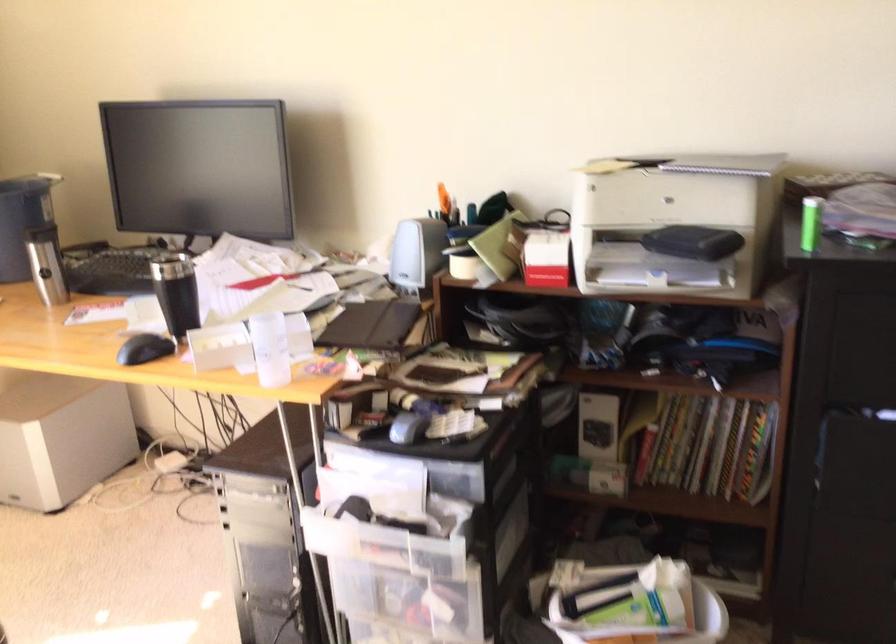
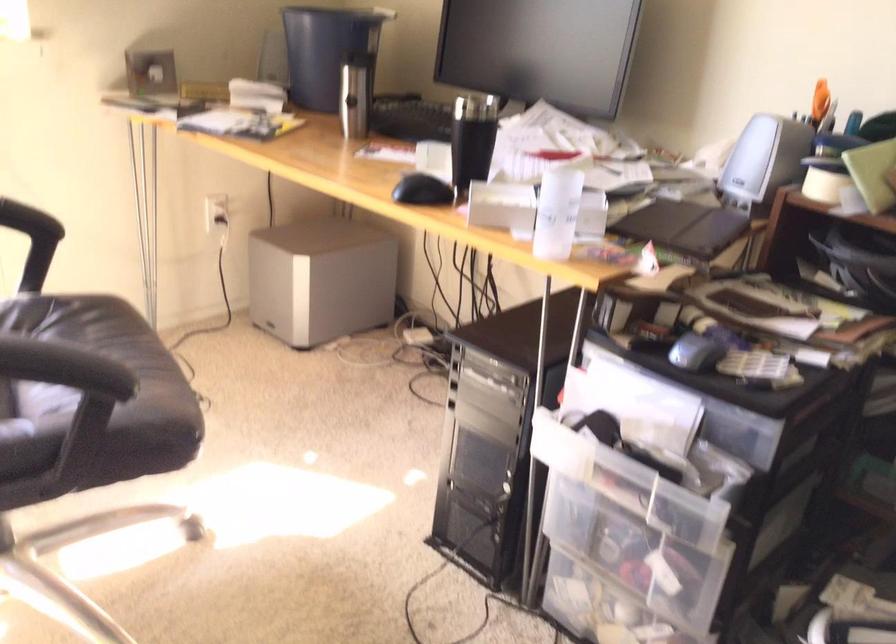
Locate, in the second image, the point that corresponds to [272,346] in the first image.

(556, 213)